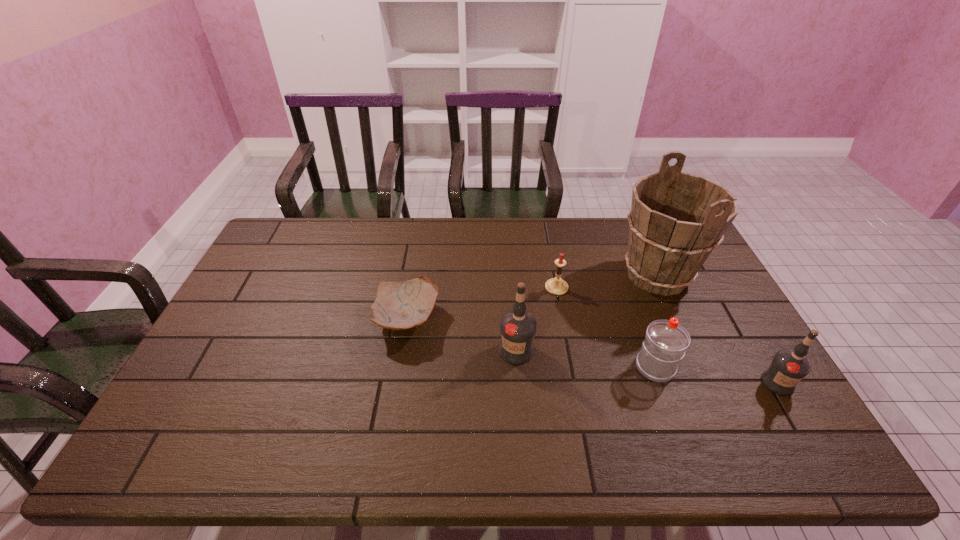
In order to click on bucket that is positioned at the right edge in this screenshot , I will do `click(676, 220)`.

This screenshot has height=540, width=960. In order to click on object located at the far right corner in this screenshot , I will do `click(676, 220)`.

Image resolution: width=960 pixels, height=540 pixels. I want to click on object present at the near right corner, so click(x=788, y=367).

Where is `vacant area at the far edge of the desktop`? Image resolution: width=960 pixels, height=540 pixels. vacant area at the far edge of the desktop is located at coordinates (401, 218).

Locate an element on the screen. The height and width of the screenshot is (540, 960). vacant region at the near edge of the desktop is located at coordinates (701, 407).

This screenshot has height=540, width=960. What are the coordinates of `vacant space at the left edge` in the screenshot? It's located at (271, 278).

Find the location of a particular element. vacant space at the right edge is located at coordinates (704, 323).

You are a GUI agent. You are given a task and a screenshot of the screen. Output one action in this format:
    pyautogui.click(x=<x>, y=<y>)
    Task: Click on the free point at the far left corner
    The width and height of the screenshot is (960, 540).
    Given the screenshot: What is the action you would take?
    pyautogui.click(x=302, y=232)

This screenshot has width=960, height=540. Identify the location of free space between the fifth object from right to left and the bucket. (587, 313).

The width and height of the screenshot is (960, 540). What are the coordinates of `vacant area that lies between the water bottle and the nearer vodka` in the screenshot? It's located at (716, 375).